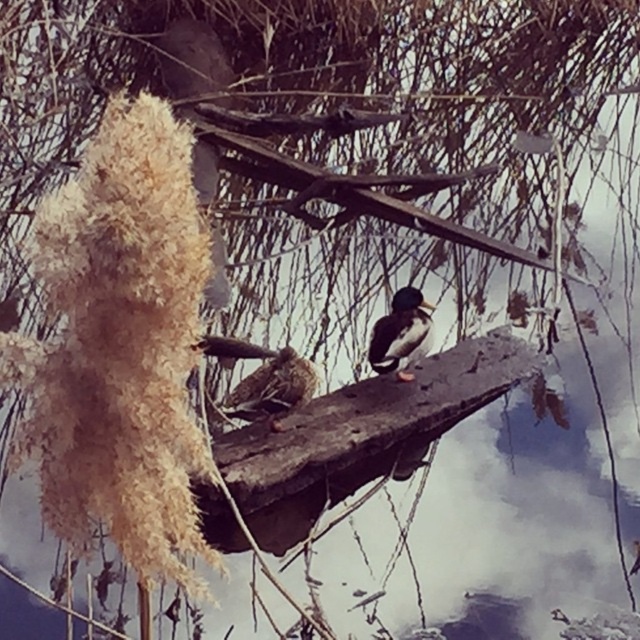
Question: Is brown speckled feathers at center wider than shiny brown duck at center?

Choices:
 (A) yes
 (B) no

Answer: (A)

Question: Can you confirm if brown speckled feathers at center is smaller than shiny brown duck at center?

Choices:
 (A) yes
 (B) no

Answer: (B)

Question: Is brown speckled feathers at center above shiny brown duck at center?

Choices:
 (A) no
 (B) yes

Answer: (A)